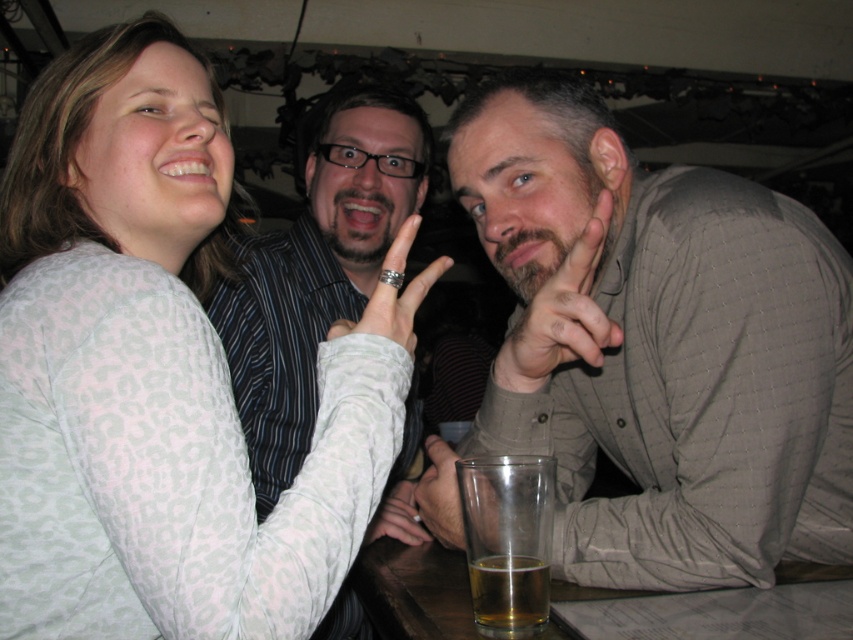
You are at a party and want to find the person wearing the white leopard print shirt at upper left. Which direction should you look relative to the matte black ring at center?

The white leopard print shirt at upper left is located to the left of the matte black ring at center, so you should look to the left of the matte black ring at center to find it.

You are a photographer at the event and want to capture a closeup of both the matte gray shirt at center and the matte silver ring at center in the same frame. What is the minimum distance your camera needs to be from the subjects to include both?

The minimum distance your camera needs to be from the subjects to include both the matte gray shirt at center and the matte silver ring at center is 38.54 centimeters, as they are 38.54 centimeters apart from each other.